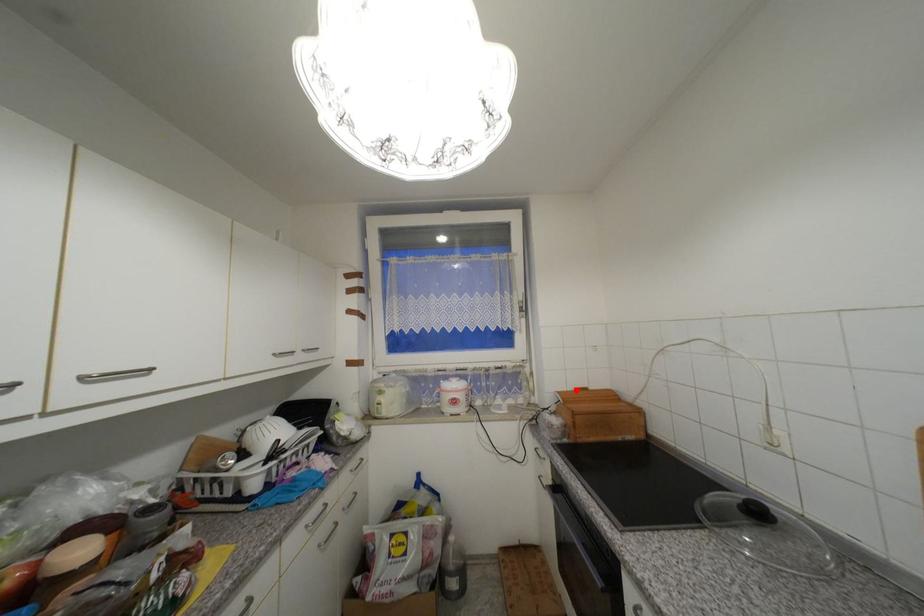
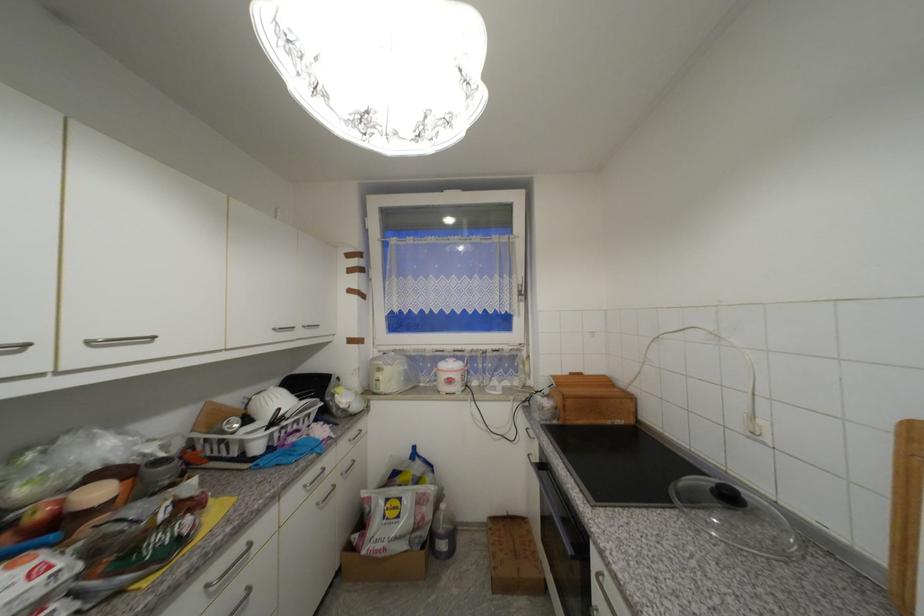
The point at the highlighted location is marked in the first image. Where is the corresponding point in the second image?

(572, 374)